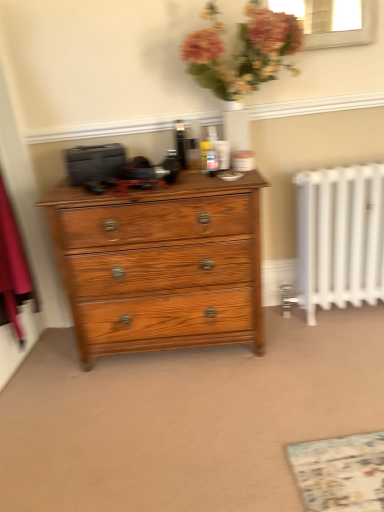
What do you see at coordinates (161, 264) in the screenshot? Image resolution: width=384 pixels, height=512 pixels. I see `wooden chest of drawers at center` at bounding box center [161, 264].

I want to click on wooden chest of drawers at center, so click(x=161, y=264).

Measure the distance between wooden chest of drawers at center and camera.

wooden chest of drawers at center is 1.66 meters from camera.

At what (x,y) coordinates should I click in order to perform the action: click on wooden chest of drawers at center. Please return your answer as a coordinate pair (x, y). Looking at the image, I should click on (161, 264).